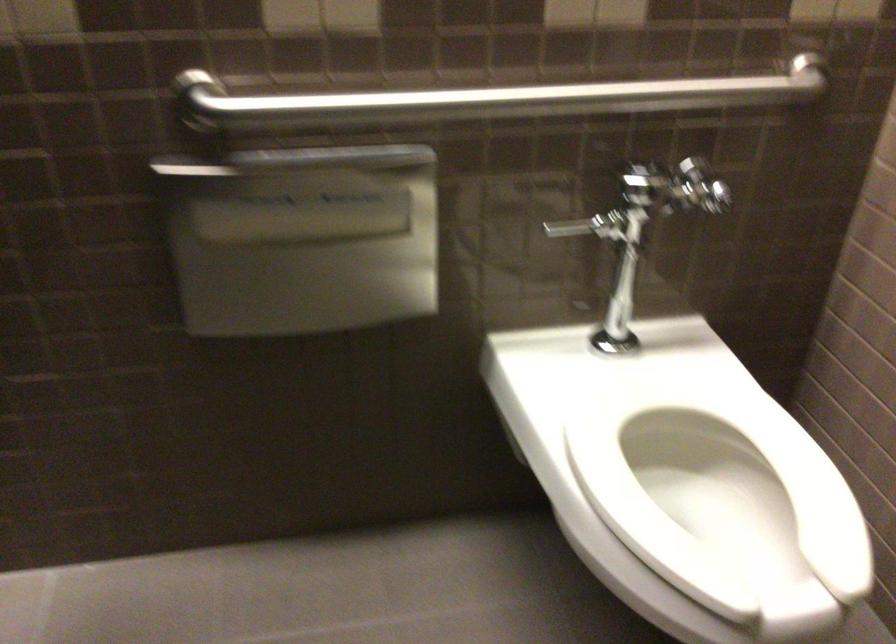
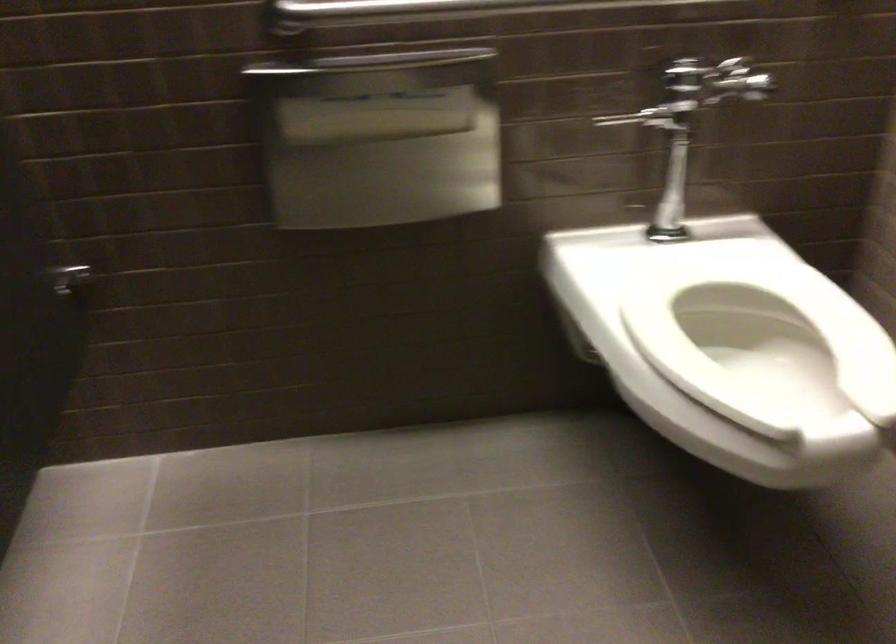
Question: What movement of the cameraman would produce the second image?

Choices:
 (A) Left
 (B) Right
 (C) Forward
 (D) Backward

Answer: (D)